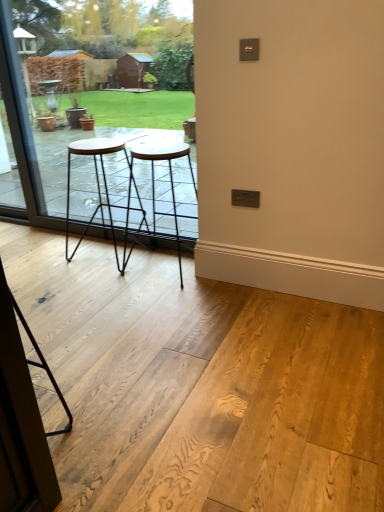
Locate an element on the screen. transparent glass window at center is located at coordinates (85, 87).

Identify the location of black metal stool at center, the second stool from the left. This screenshot has width=384, height=512. (154, 189).

Would you say transparent glass window at center is outside wooden stool at center, positioned as the 1th stool in left-to-right order?

Absolutely, transparent glass window at center is external to wooden stool at center, positioned as the 1th stool in left-to-right order.

Looking at the image, does transparent glass window at center seem bigger or smaller compared to wooden stool at center, marked as the 2th stool in a right-to-left arrangement?

In the image, transparent glass window at center appears to be larger than wooden stool at center, marked as the 2th stool in a right-to-left arrangement.

Is transparent glass window at center positioned with its back to wooden stool at center, marked as the 2th stool in a right-to-left arrangement?

Absolutely, transparent glass window at center is directed away from wooden stool at center, marked as the 2th stool in a right-to-left arrangement.

Which is in front, transparent glass window at center or wooden stool at center, marked as the 2th stool in a right-to-left arrangement?

Positioned in front is transparent glass window at center.

At what (x,y) coordinates should I click in order to perform the action: click on window above the black metal stool at center, the first stool when ordered from right to left (from the image's perspective). Please return your answer as a coordinate pair (x, y). Looking at the image, I should click on (85, 87).

From a real-world perspective, does black metal stool at center, the second stool from the left, sit lower than transparent glass window at center?

Correct, in the physical world, black metal stool at center, the second stool from the left, is lower than transparent glass window at center.

Considering the sizes of objects black metal stool at center, the first stool when ordered from right to left, and transparent glass window at center in the image provided, who is wider, black metal stool at center, the first stool when ordered from right to left, or transparent glass window at center?

black metal stool at center, the first stool when ordered from right to left, is wider.

Can you tell me how much transparent glass screen door at lower left and wooden stool at center, marked as the 2th stool in a right-to-left arrangement, differ in facing direction?

0.53 degrees.

Between transparent glass screen door at lower left and wooden stool at center, marked as the 2th stool in a right-to-left arrangement, which one has less height?

wooden stool at center, marked as the 2th stool in a right-to-left arrangement.

Which object is further away from the camera, transparent glass screen door at lower left or wooden stool at center, marked as the 2th stool in a right-to-left arrangement?

wooden stool at center, marked as the 2th stool in a right-to-left arrangement, is further away from the camera.

Is transparent glass screen door at lower left spatially inside wooden stool at center, marked as the 2th stool in a right-to-left arrangement, or outside of it?

transparent glass screen door at lower left is not enclosed by wooden stool at center, marked as the 2th stool in a right-to-left arrangement.

Which is in front, point (139, 203) or point (24, 446)?

The point (24, 446) is in front.

In the image, is wooden stool at center, positioned as the 1th stool in left-to-right order, positioned in front of or behind transparent glass screen door at lower left?

wooden stool at center, positioned as the 1th stool in left-to-right order, is behind transparent glass screen door at lower left.

Considering the relative sizes of wooden stool at center, positioned as the 1th stool in left-to-right order, and transparent glass screen door at lower left in the image provided, is wooden stool at center, positioned as the 1th stool in left-to-right order, smaller than transparent glass screen door at lower left?

No.

From a real-world perspective, does wooden stool at center, marked as the 2th stool in a right-to-left arrangement, stand above transparent glass screen door at lower left?

Yes.

Would you say transparent glass window at center is part of transparent glass screen door at lower left's contents?

Actually, transparent glass window at center is outside transparent glass screen door at lower left.

Is transparent glass screen door at lower left wider than transparent glass window at center?

Correct, the width of transparent glass screen door at lower left exceeds that of transparent glass window at center.

How many degrees apart are the facing directions of transparent glass screen door at lower left and transparent glass window at center?

The angle between the facing direction of transparent glass screen door at lower left and the facing direction of transparent glass window at center is 1.54 degrees.

Is transparent glass screen door at lower left far from transparent glass window at center?

Indeed, transparent glass screen door at lower left is not near transparent glass window at center.

Is transparent glass window at center a part of wooden stool at center, positioned as the 1th stool in left-to-right order?

No, transparent glass window at center is not inside wooden stool at center, positioned as the 1th stool in left-to-right order.

From the image's perspective, which is below, wooden stool at center, marked as the 2th stool in a right-to-left arrangement, or transparent glass window at center?

wooden stool at center, marked as the 2th stool in a right-to-left arrangement, from the image's perspective.

Which of these two, wooden stool at center, marked as the 2th stool in a right-to-left arrangement, or transparent glass window at center, is wider?

wooden stool at center, marked as the 2th stool in a right-to-left arrangement, is wider.

Is wooden stool at center, positioned as the 1th stool in left-to-right order, taller or shorter than transparent glass window at center?

Clearly, wooden stool at center, positioned as the 1th stool in left-to-right order, is shorter compared to transparent glass window at center.

From a real-world perspective, does transparent glass window at center sit lower than black metal stool at center, the second stool from the left?

Incorrect, from a real-world perspective, transparent glass window at center is higher than black metal stool at center, the second stool from the left.

Is transparent glass window at center further to the viewer compared to black metal stool at center, the second stool from the left?

No, it is not.

Locate an element on the screen. window lying above the black metal stool at center, the second stool from the left (from the image's perspective) is located at coordinates (85, 87).

There is a transparent glass window at center. Where is `the 2nd stool below it (from a real-world perspective)`? the 2nd stool below it (from a real-world perspective) is located at coordinates (96, 181).

Where is `stool that is the 2nd object to the right of the transparent glass window at center, starting at the anchor`? This screenshot has width=384, height=512. stool that is the 2nd object to the right of the transparent glass window at center, starting at the anchor is located at coordinates (154, 189).

Based on their spatial positions, is transparent glass screen door at lower left or wooden stool at center, marked as the 2th stool in a right-to-left arrangement, further from black metal stool at center, the first stool when ordered from right to left?

transparent glass screen door at lower left is positioned further to the anchor black metal stool at center, the first stool when ordered from right to left.

From the image, which object appears to be nearer to black metal stool at center, the second stool from the left, transparent glass screen door at lower left or transparent glass window at center?

transparent glass screen door at lower left lies closer to black metal stool at center, the second stool from the left, than the other object.

Based on their spatial positions, is black metal stool at center, the first stool when ordered from right to left, or transparent glass screen door at lower left closer to wooden stool at center, marked as the 2th stool in a right-to-left arrangement?

Among the two, black metal stool at center, the first stool when ordered from right to left, is located nearer to wooden stool at center, marked as the 2th stool in a right-to-left arrangement.

When comparing their distances from transparent glass screen door at lower left, does transparent glass window at center or wooden stool at center, marked as the 2th stool in a right-to-left arrangement, seem further?

Among the two, transparent glass window at center is located further to transparent glass screen door at lower left.

Estimate the real-world distances between objects in this image. Which object is further from transparent glass screen door at lower left, black metal stool at center, the first stool when ordered from right to left, or transparent glass window at center?

The object further to transparent glass screen door at lower left is transparent glass window at center.

Considering their positions, is wooden stool at center, marked as the 2th stool in a right-to-left arrangement, positioned closer to transparent glass screen door at lower left than transparent glass window at center?

wooden stool at center, marked as the 2th stool in a right-to-left arrangement.

Based on their spatial positions, is transparent glass screen door at lower left or black metal stool at center, the first stool when ordered from right to left, closer to transparent glass window at center?

Among the two, black metal stool at center, the first stool when ordered from right to left, is located nearer to transparent glass window at center.

Looking at the image, which one is located further to wooden stool at center, positioned as the 1th stool in left-to-right order, transparent glass window at center or transparent glass screen door at lower left?

transparent glass screen door at lower left.

At what (x,y) coordinates should I click in order to perform the action: click on stool positioned between transparent glass screen door at lower left and wooden stool at center, positioned as the 1th stool in left-to-right order, from near to far. Please return your answer as a coordinate pair (x, y). The image size is (384, 512). Looking at the image, I should click on (154, 189).

This screenshot has height=512, width=384. Identify the location of window between transparent glass screen door at lower left and black metal stool at center, the second stool from the left, along the z-axis. (85, 87).

At what (x,y) coordinates should I click in order to perform the action: click on stool between transparent glass window at center and black metal stool at center, the first stool when ordered from right to left, vertically. Please return your answer as a coordinate pair (x, y). Looking at the image, I should click on (96, 181).

You are a GUI agent. You are given a task and a screenshot of the screen. Output one action in this format:
    pyautogui.click(x=<x>, y=<y>)
    Task: Click on the window between transparent glass screen door at lower left and wooden stool at center, marked as the 2th stool in a right-to-left arrangement, in the front-back direction
    Image resolution: width=384 pixels, height=512 pixels.
    Given the screenshot: What is the action you would take?
    pyautogui.click(x=85, y=87)